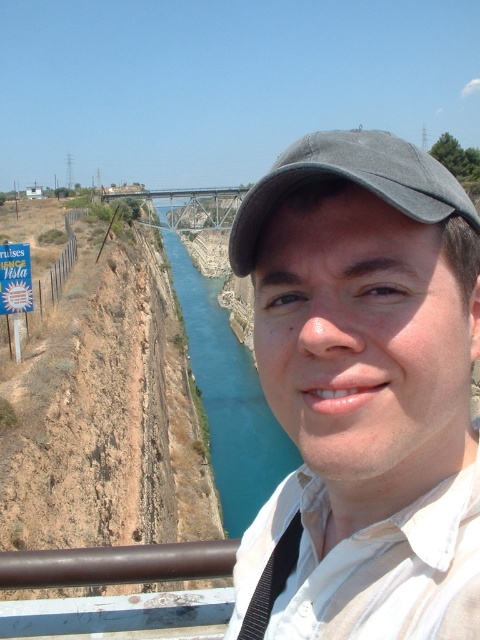
You are a photographer trying to capture the bridge in the background. You notice two points marked as point [277,371] and point [476,225]. Which point is closer to your camera lens?

Point [277,371] is further to the camera than point [476,225], so the point closer to your camera lens is point [476,225].

From the picture: You are a photographer planning to capture the scenic canal with both the blue water at center and the blue paper sign at upper left in your shot. Based on their sizes in the image, which object would require more careful framing to ensure it doesn not get lost in the composition?

The blue paper sign at upper left requires more careful framing because it is smaller in width compared to the blue water at center.